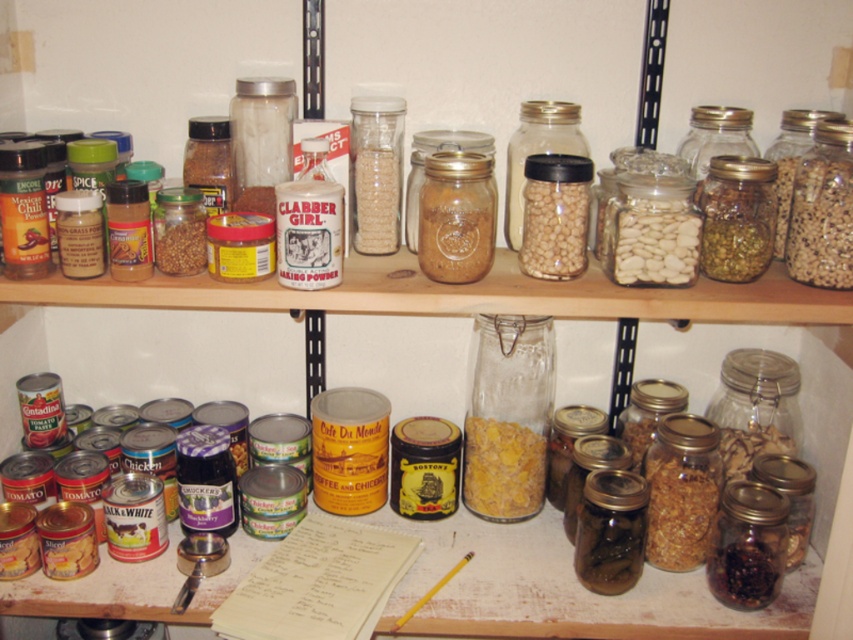
You are organizing the pantry and need to place a new item between the white matte beans at center and the yellow matte corn at center. Based on their positions, which one should you move closer to you to make space?

Since the white matte beans at center is closer to the viewer than the yellow matte corn at center, you should move the white matte beans at center forward to create space between them.

You are organizing the pantry and need to place a new spice jar between the clear glass jar at center and the translucent glass jar at center. Based on their positions, which jar should you place the new spice jar next to?

The clear glass jar at center is to the left of the translucent glass jar at center, so you should place the new spice jar between them, next to the clear glass jar at center on its right side or the translucent glass jar at center on its left side depending on desired placement.

You are organizing a pantry and want to place the white matte beans at center and yellow matte corn at center on the same shelf. According to the current arrangement, which one is placed above the other?

The white matte beans at center is positioned over yellow matte corn at center, so it is placed above the yellow matte corn at center.